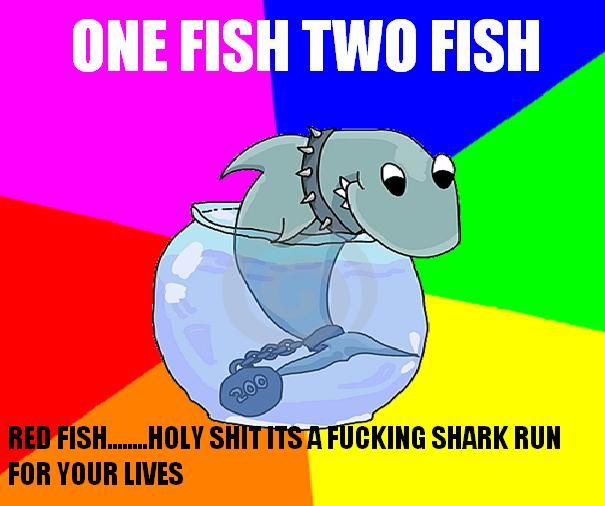
Where is `bowl`? The image size is (605, 506). bowl is located at coordinates (203, 303).